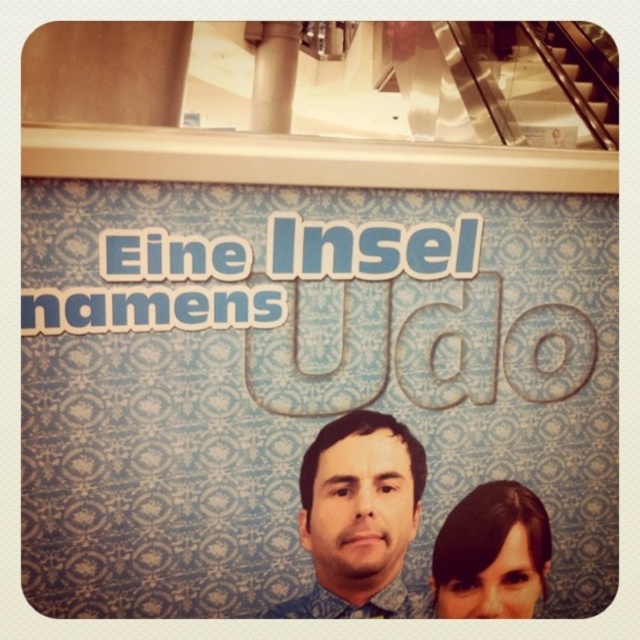
Question: Considering the real-world distances, which object is farthest from the dark brown hair at upper center?

Choices:
 (A) metallic silver escalator at upper right
 (B) blue patterned shirt at center

Answer: (A)

Question: Is blue patterned shirt at center wider than dark brown hair at upper center?

Choices:
 (A) yes
 (B) no

Answer: (A)

Question: Estimate the real-world distances between objects in this image. Which object is closer to the metallic silver escalator at upper right?

Choices:
 (A) blue patterned shirt at center
 (B) dark brown hair at upper center

Answer: (B)

Question: Estimate the real-world distances between objects in this image. Which object is farther from the blue patterned shirt at center?

Choices:
 (A) metallic silver escalator at upper right
 (B) dark brown hair at upper center

Answer: (A)

Question: Does blue patterned shirt at center have a smaller size compared to dark brown hair at upper center?

Choices:
 (A) yes
 (B) no

Answer: (B)

Question: Can you confirm if blue patterned shirt at center is positioned to the right of dark brown hair at upper center?

Choices:
 (A) yes
 (B) no

Answer: (B)